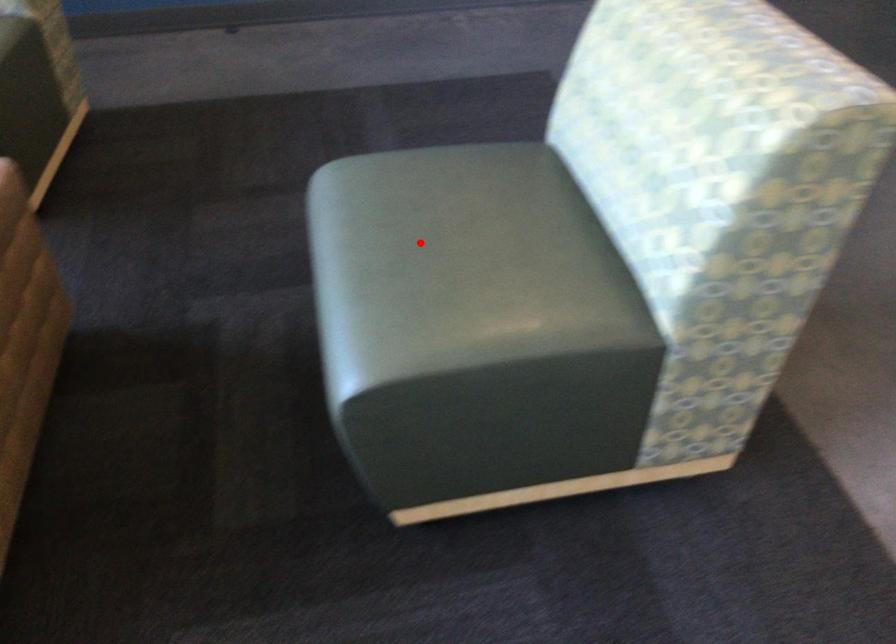
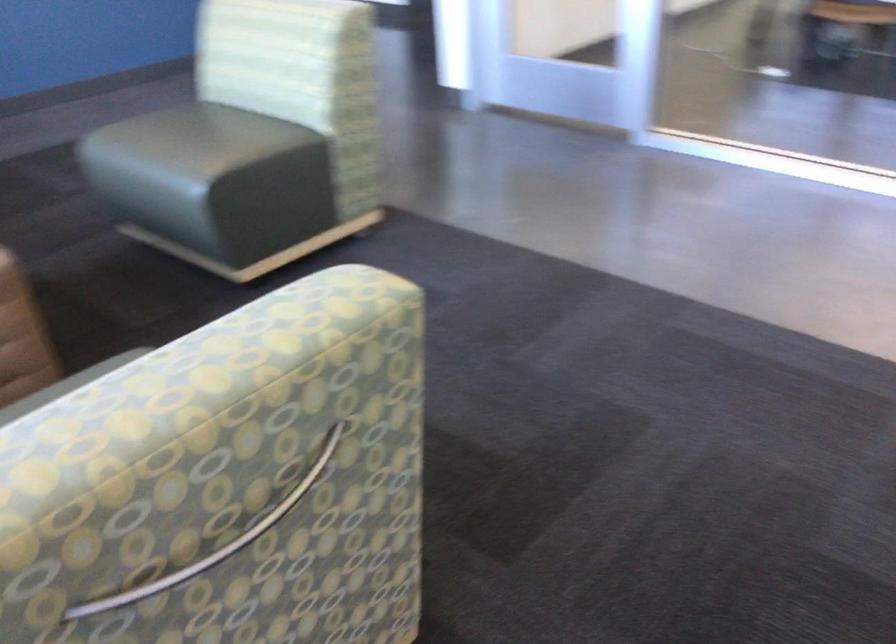
Question: I am providing you with two images of the same scene from different viewpoints. A red point is marked on the first image. Can you still see the location of the red point in image 2?

Choices:
 (A) Yes
 (B) No

Answer: (A)